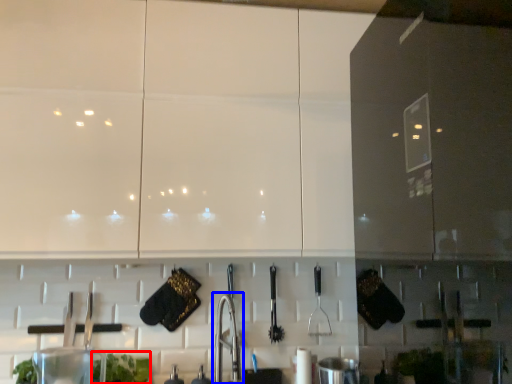
Question: Which of the following is the closest to the observer, plant (highlighted by a red box) or faucet (highlighted by a blue box)?

Choices:
 (A) plant
 (B) faucet

Answer: (B)